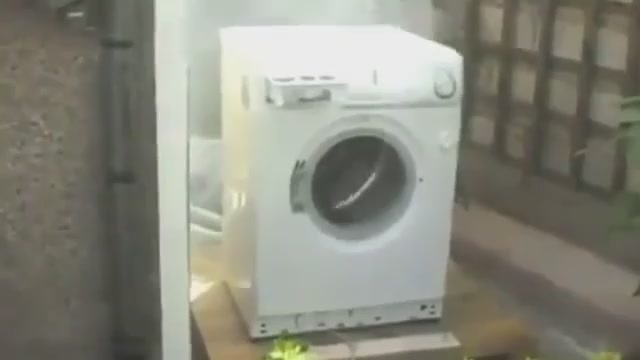
Where is `washer`? washer is located at coordinates (419, 255).